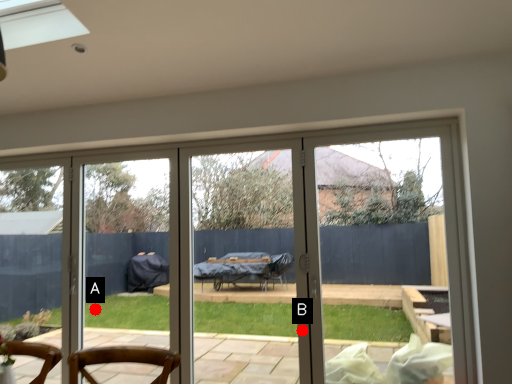
Question: Two points are circled on the image, labeled by A and B beside each circle. Among these points, which one is farthest from the camera?

Choices:
 (A) A is further
 (B) B is further

Answer: (A)